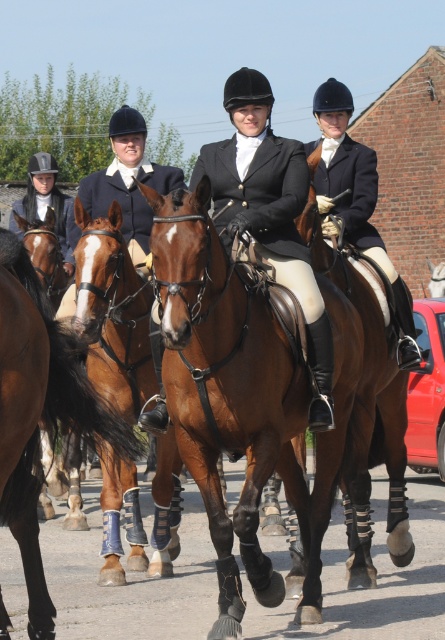
Which is in front, point (230, 193) or point (409, 312)?

Point (230, 193) is in front.

Does point (326, 324) come in front of point (359, 170)?

Yes, point (326, 324) is closer to viewer.

Is point (198, 172) more distant than point (350, 93)?

No, (198, 172) is closer to viewer.

At what (x,y) coordinates should I click in order to perform the action: click on black leather jacket at center. Please return your answer as a coordinate pair (x, y). This screenshot has height=640, width=445. Looking at the image, I should click on (270, 212).

Between brown glossy horse at center and matte black jacket at center, which one has less height?

matte black jacket at center is shorter.

Is brown glossy horse at center thinner than matte black jacket at center?

Incorrect, brown glossy horse at center's width is not less than matte black jacket at center's.

Where is `brown glossy horse at center`? brown glossy horse at center is located at coordinates (267, 401).

The image size is (445, 640). Identify the location of brown glossy horse at center. (267, 401).

Between point (205, 406) and point (246, 147), which one is positioned behind?

Point (246, 147)

The image size is (445, 640). What are the coordinates of `brown glossy horse at center` in the screenshot? It's located at (267, 401).

Who is more distant from viewer, (335, 262) or (294, 204)?

The point (335, 262) is behind.

Where is `brown glossy horse at center`? brown glossy horse at center is located at coordinates pyautogui.click(x=267, y=401).